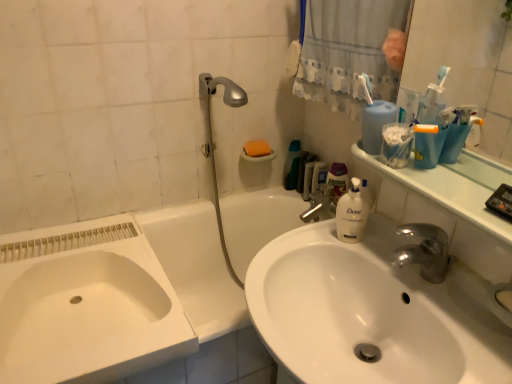
Question: Is point (343, 193) positioned closer to the camera than point (279, 284)?

Choices:
 (A) farther
 (B) closer

Answer: (A)

Question: Considering the positions of translucent plastic bottle at center, marked as the 1th cleaning product in a right-to-left arrangement, and white glossy sink at center, which appears as the first sink when viewed from the right, in the image, is translucent plastic bottle at center, marked as the 1th cleaning product in a right-to-left arrangement, wider or thinner than white glossy sink at center, which appears as the first sink when viewed from the right,?

Choices:
 (A) thin
 (B) wide

Answer: (A)

Question: Considering the real-world distances, which object is farthest from the green matte cleaning product at upper right, which ranks as the 1th cleaning product in left-to-right order?

Choices:
 (A) white plastic toothbrush at upper right
 (B) white fabric shower curtain at upper center
 (C) white glossy sink at center, which appears as the first sink when viewed from the right
 (D) clear plastic mouthwash at center
 (E) white ceramic bathtub at lower left

Answer: (C)

Question: Which object is positioned farthest from the silver metallic showerhead at upper center?

Choices:
 (A) white plastic toothbrush at upper right
 (B) white fabric shower curtain at upper center
 (C) translucent plastic bottle at center, the 2th cleaning product positioned from the left
 (D) white glossy sink at center, placed as the 2th sink when sorted from left to right
 (E) clear plastic mouthwash at center

Answer: (D)